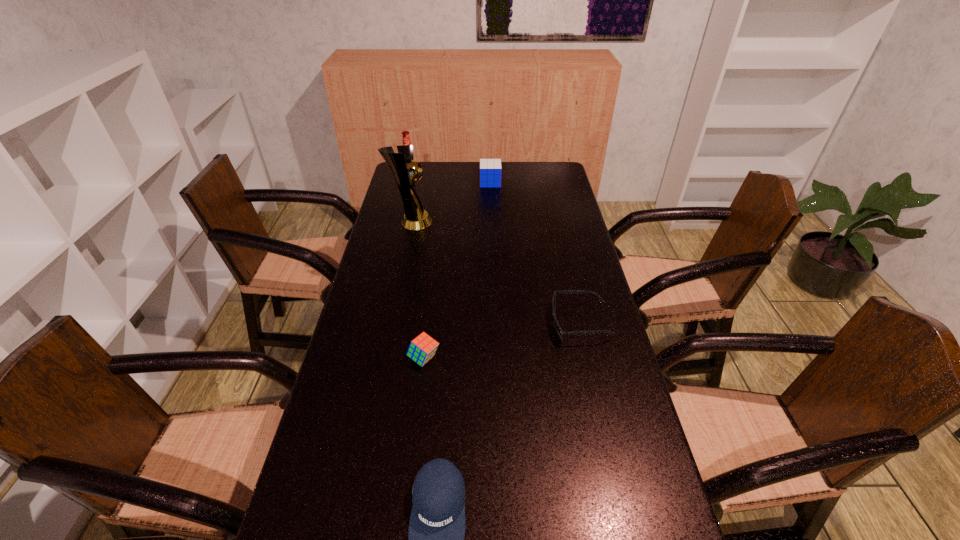
Where is `the fourth nearest object`? the fourth nearest object is located at coordinates (402, 165).

Identify the location of award. The image size is (960, 540). [x=402, y=165].

Locate an element on the screen. The width and height of the screenshot is (960, 540). the second tallest object is located at coordinates (406, 140).

Image resolution: width=960 pixels, height=540 pixels. I want to click on the farther cube, so click(x=490, y=169).

The image size is (960, 540). I want to click on the right cube, so click(x=490, y=169).

The width and height of the screenshot is (960, 540). Identify the location of the nearer cube. (422, 348).

Identify the location of the shorter cube. This screenshot has height=540, width=960. (422, 348).

Image resolution: width=960 pixels, height=540 pixels. Identify the location of the rightmost object. (560, 332).

Where is `the third nearest object`? The width and height of the screenshot is (960, 540). the third nearest object is located at coordinates (560, 332).

This screenshot has width=960, height=540. Identify the location of free space located at the front of the award, where the globe is visible. (468, 222).